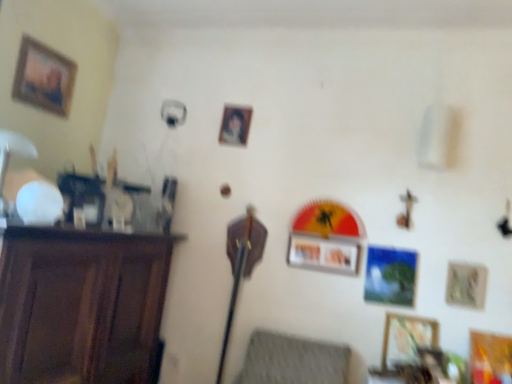
Locate an element on the screen. metallic silver picture frame at lower right, the fifth picture frame when ordered from left to right is located at coordinates (466, 285).

Measure the distance between point (260, 363) and camera.

The distance of point (260, 363) from camera is 2.33 meters.

This screenshot has height=384, width=512. What are the coordinates of `wooden picture frame at lower right, positioned as the sixth picture frame in left-to-right order` in the screenshot? It's located at (490, 358).

What do you see at coordinates (234, 125) in the screenshot?
I see `matte plastic picture frame at center, the second picture frame viewed from the left` at bounding box center [234, 125].

You are a GUI agent. You are given a task and a screenshot of the screen. Output one action in this format:
    pyautogui.click(x=<x>, y=<y>)
    Task: Click on the dark wood cabinet at left
    This screenshot has height=384, width=512.
    Given the screenshot: What is the action you would take?
    pyautogui.click(x=81, y=305)

Describe the element at coordinates (81, 305) in the screenshot. I see `dark wood cabinet at left` at that location.

This screenshot has height=384, width=512. Find the location of `metallic silver picture frame at lower right, the fifth picture frame when ordered from left to right`. metallic silver picture frame at lower right, the fifth picture frame when ordered from left to right is located at coordinates (466, 285).

Is wooden picture frame at center, positioned as the third picture frame in left-to-right order, thinner than dark wood cabinet at left?

Correct, the width of wooden picture frame at center, positioned as the third picture frame in left-to-right order, is less than that of dark wood cabinet at left.

Is wooden picture frame at center, the third picture frame viewed from the top, positioned beyond the bounds of dark wood cabinet at left?

Indeed, wooden picture frame at center, the third picture frame viewed from the top, is completely outside dark wood cabinet at left.

From a real-world perspective, who is located higher, wooden picture frame at center, positioned as the third picture frame in left-to-right order, or dark wood cabinet at left?

wooden picture frame at center, positioned as the third picture frame in left-to-right order, from a real-world perspective.

The width and height of the screenshot is (512, 384). What are the coordinates of `furniture lying below the wooden picture frame at center, which ranks as the 4th picture frame in right-to-left order (from the image's perspective)` in the screenshot? It's located at (81, 305).

The height and width of the screenshot is (384, 512). I want to click on the 2nd picture frame behind when counting from the wooden framed portrait at upper left, positioned as the first picture frame in left-to-right order, so click(406, 338).

From the picture: Looking at the image, does wooden framed portrait at upper left, arranged as the sixth picture frame when viewed from the right, seem bigger or smaller compared to wooden picture frame at lower right, the fourth picture frame viewed from the left?

wooden framed portrait at upper left, arranged as the sixth picture frame when viewed from the right, is bigger than wooden picture frame at lower right, the fourth picture frame viewed from the left.

From a real-world perspective, which is physically above, wooden framed portrait at upper left, arranged as the sixth picture frame when viewed from the right, or wooden picture frame at lower right, the fourth picture frame viewed from the left?

From a 3D spatial view, wooden framed portrait at upper left, arranged as the sixth picture frame when viewed from the right, is above.

Between wooden picture frame at center, positioned as the third picture frame in left-to-right order, and wooden picture frame at lower right, which appears as the first picture frame when viewed from the right, which one has larger width?

Wider between the two is wooden picture frame at lower right, which appears as the first picture frame when viewed from the right.

Between wooden picture frame at center, positioned as the third picture frame in left-to-right order, and wooden picture frame at lower right, the 6th picture frame when ordered from top to bottom, which one has more height?

wooden picture frame at lower right, the 6th picture frame when ordered from top to bottom, is taller.

Which point is more forward, (357, 268) or (483, 375)?

The point (483, 375) is closer.

Is dark wood cabinet at left facing away from wooden picture frame at lower right, the 6th picture frame when ordered from top to bottom?

No, wooden picture frame at lower right, the 6th picture frame when ordered from top to bottom, is not at the back of dark wood cabinet at left.

From a real-world perspective, is dark wood cabinet at left under wooden picture frame at lower right, positioned as the sixth picture frame in left-to-right order?

Correct, in the physical world, dark wood cabinet at left is lower than wooden picture frame at lower right, positioned as the sixth picture frame in left-to-right order.

Considering the sizes of objects dark wood cabinet at left and wooden picture frame at lower right, positioned as the sixth picture frame in left-to-right order, in the image provided, who is thinner, dark wood cabinet at left or wooden picture frame at lower right, positioned as the sixth picture frame in left-to-right order,?

wooden picture frame at lower right, positioned as the sixth picture frame in left-to-right order.

Does dark wood cabinet at left have a lesser height compared to wooden picture frame at lower right, the 6th picture frame when ordered from top to bottom?

In fact, dark wood cabinet at left may be taller than wooden picture frame at lower right, the 6th picture frame when ordered from top to bottom.

Is wooden picture frame at lower right, which appears as the first picture frame when viewed from the right, oriented towards dark wood cabinet at left?

No.

Between wooden picture frame at lower right, acting as the first picture frame starting from the bottom, and dark wood cabinet at left, which one has less height?

wooden picture frame at lower right, acting as the first picture frame starting from the bottom, is shorter.

Is wooden picture frame at lower right, the 6th picture frame when ordered from top to bottom, thinner than dark wood cabinet at left?

Yes, wooden picture frame at lower right, the 6th picture frame when ordered from top to bottom, is thinner than dark wood cabinet at left.

From a real-world perspective, who is located lower, wooden picture frame at lower right, which appears as the first picture frame when viewed from the right, or dark wood cabinet at left?

In real-world perspective, dark wood cabinet at left is lower.

From the image's perspective, is matte plastic picture frame at center, the second picture frame viewed from the left, located above wooden picture frame at center, which ranks as the 4th picture frame in right-to-left order?

Indeed, from the image's perspective, matte plastic picture frame at center, the second picture frame viewed from the left, is shown above wooden picture frame at center, which ranks as the 4th picture frame in right-to-left order.

From the image's perspective, starting from the wooden picture frame at center, positioned as the third picture frame in left-to-right order, which picture frame is the 1st one above? Please provide its 2D coordinates.

[(234, 125)]

Is point (246, 138) farther from viewer compared to point (293, 240)?

Yes.

Can wooden picture frame at center, positioned as the third picture frame in left-to-right order, be found inside matte plastic picture frame at center, which appears as the fifth picture frame when ordered from the bottom?

No.

Between textured gray cushion at lower center and wooden picture frame at lower right, placed as the 2th picture frame when sorted from bottom to top, which one appears on the left side from the viewer's perspective?

Positioned to the left is textured gray cushion at lower center.

Can you see textured gray cushion at lower center touching wooden picture frame at lower right, placed as the 3th picture frame when sorted from right to left?

They are not placed beside each other.

Is point (346, 367) closer to camera compared to point (417, 362)?

No, (346, 367) is behind (417, 362).

Is textured gray cushion at lower center spatially inside wooden picture frame at lower right, arranged as the fifth picture frame when viewed from the top, or outside of it?

textured gray cushion at lower center is spatially situated outside wooden picture frame at lower right, arranged as the fifth picture frame when viewed from the top.

Identify the location of furniture below the wooden picture frame at center, the third picture frame viewed from the top (from the image's perspective). The height and width of the screenshot is (384, 512). (81, 305).

Identify the location of the 4th picture frame below the wooden framed portrait at upper left, arranged as the sixth picture frame when viewed from the right (from a real-world perspective). (406, 338).

Looking at the image, which one is located further to metallic silver picture frame at lower right, arranged as the 3th picture frame when ordered from the bottom, wooden picture frame at lower right, positioned as the sixth picture frame in left-to-right order, or wooden picture frame at lower right, placed as the 3th picture frame when sorted from right to left?

Among the two, wooden picture frame at lower right, placed as the 3th picture frame when sorted from right to left, is located further to metallic silver picture frame at lower right, arranged as the 3th picture frame when ordered from the bottom.

Consider the image. Based on their spatial positions, is dark wood cabinet at left or textured gray cushion at lower center closer to wooden picture frame at center, which is counted as the 4th picture frame, starting from the bottom?

textured gray cushion at lower center lies closer to wooden picture frame at center, which is counted as the 4th picture frame, starting from the bottom, than the other object.

Looking at the image, which one is located further to dark wood cabinet at left, wooden picture frame at lower right, placed as the 2th picture frame when sorted from bottom to top, or textured gray cushion at lower center?

Based on the image, wooden picture frame at lower right, placed as the 2th picture frame when sorted from bottom to top, appears to be further to dark wood cabinet at left.

Which object lies further to the anchor point wooden framed portrait at upper left, arranged as the sixth picture frame when viewed from the right, wooden picture frame at lower right, placed as the 3th picture frame when sorted from right to left, or metallic silver picture frame at lower right, arranged as the 3th picture frame when ordered from the bottom?

metallic silver picture frame at lower right, arranged as the 3th picture frame when ordered from the bottom, is positioned further to the anchor wooden framed portrait at upper left, arranged as the sixth picture frame when viewed from the right.

Estimate the real-world distances between objects in this image. Which object is further from wooden framed portrait at upper left, positioned as the first picture frame in left-to-right order, matte plastic picture frame at center, which is the 2th picture frame from top to bottom, or wooden picture frame at lower right, placed as the 3th picture frame when sorted from right to left?

wooden picture frame at lower right, placed as the 3th picture frame when sorted from right to left, lies further to wooden framed portrait at upper left, positioned as the first picture frame in left-to-right order, than the other object.

When comparing their distances from dark wood cabinet at left, does wooden picture frame at lower right, which appears as the first picture frame when viewed from the right, or metallic silver picture frame at lower right, which is counted as the second picture frame, starting from the right, seem closer?

Based on the image, metallic silver picture frame at lower right, which is counted as the second picture frame, starting from the right, appears to be nearer to dark wood cabinet at left.

Considering their positions, is metallic silver picture frame at lower right, the fifth picture frame when ordered from left to right, positioned further to wooden picture frame at lower right, acting as the first picture frame starting from the bottom, than textured gray cushion at lower center?

textured gray cushion at lower center.

Considering their positions, is wooden picture frame at center, which is counted as the 4th picture frame, starting from the bottom, positioned further to wooden framed portrait at upper left, acting as the 6th picture frame starting from the bottom, than matte plastic picture frame at center, the second picture frame viewed from the left?

The object further to wooden framed portrait at upper left, acting as the 6th picture frame starting from the bottom, is wooden picture frame at center, which is counted as the 4th picture frame, starting from the bottom.

This screenshot has height=384, width=512. Identify the location of swivel chair located between dark wood cabinet at left and wooden picture frame at center, which is counted as the 4th picture frame, starting from the bottom, in the left-right direction. (293, 361).

Find the location of `furniture located between wooden framed portrait at upper left, arranged as the sixth picture frame when viewed from the right, and wooden picture frame at lower right, positioned as the sixth picture frame in left-to-right order, in the left-right direction`. furniture located between wooden framed portrait at upper left, arranged as the sixth picture frame when viewed from the right, and wooden picture frame at lower right, positioned as the sixth picture frame in left-to-right order, in the left-right direction is located at coordinates (81, 305).

Image resolution: width=512 pixels, height=384 pixels. In order to click on furniture between wooden framed portrait at upper left, positioned as the first picture frame in left-to-right order, and wooden picture frame at center, which ranks as the 4th picture frame in right-to-left order in this screenshot , I will do `click(81, 305)`.

Identify the location of swivel chair located between dark wood cabinet at left and wooden picture frame at lower right, placed as the 2th picture frame when sorted from bottom to top, in the left-right direction. (293, 361).